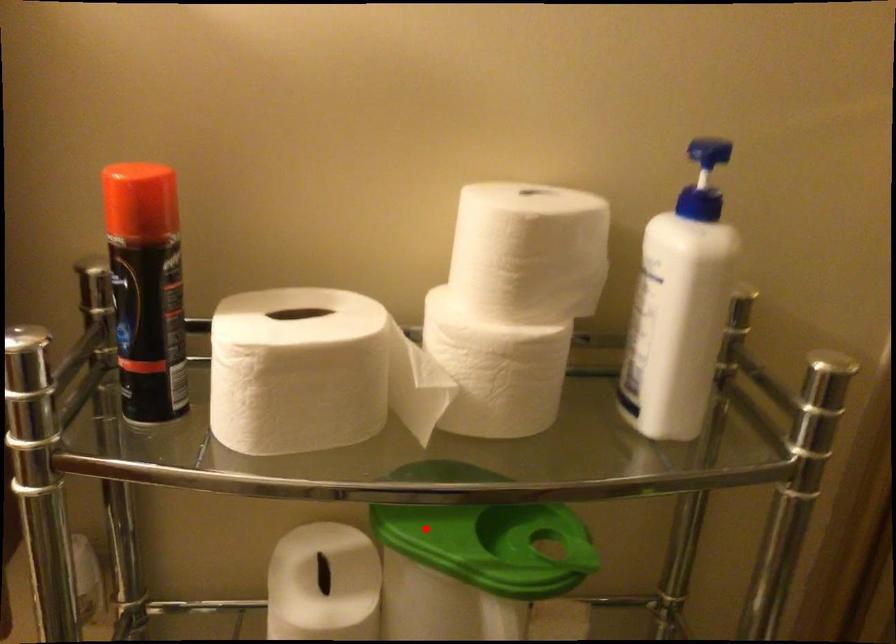
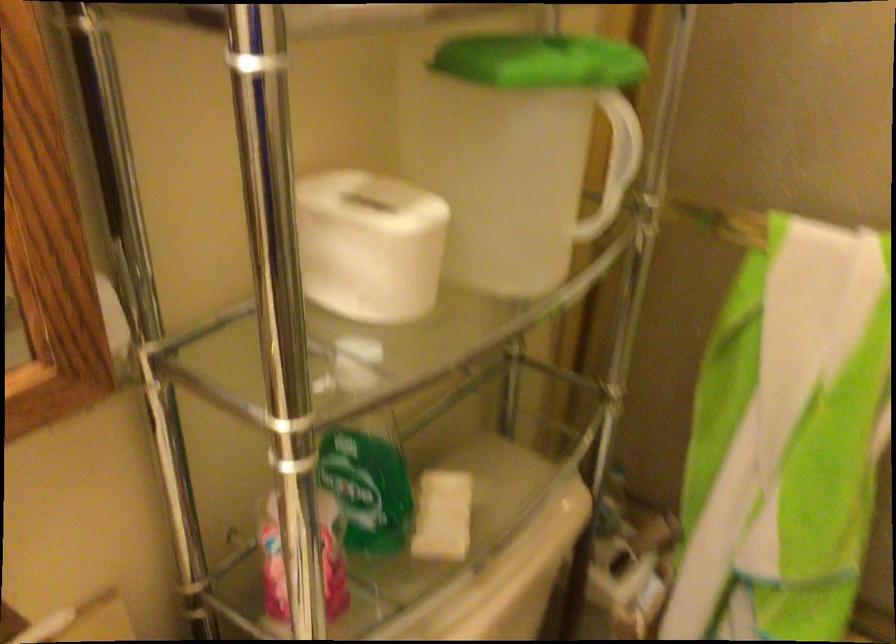
The point at the highlighted location is marked in the first image. Where is the corresponding point in the second image?

(539, 61)